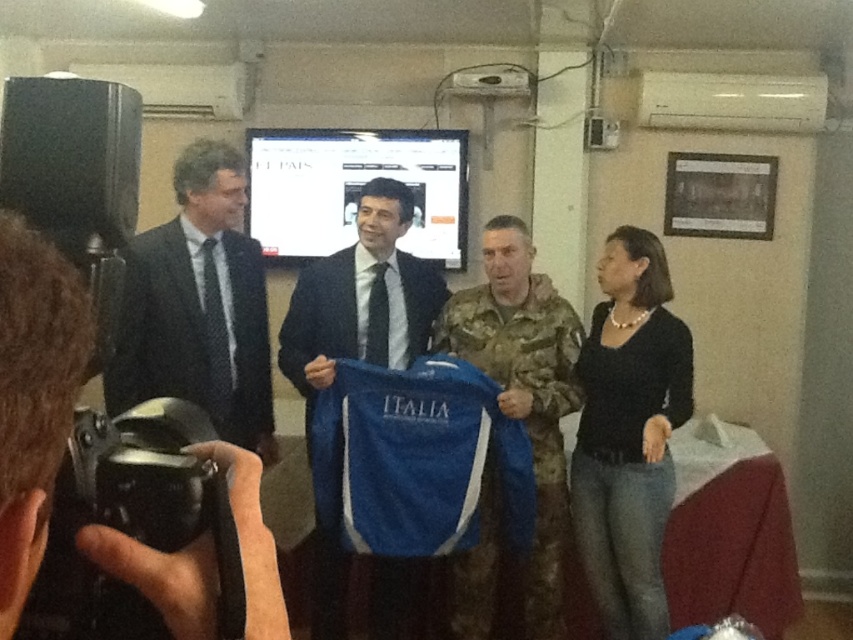
Question: Does blue fabric shirt at center have a larger size compared to matte black suit at center?

Choices:
 (A) yes
 (B) no

Answer: (A)

Question: Which point is farther to the camera?

Choices:
 (A) matte black suit at left
 (B) black plastic video camera at lower left

Answer: (A)

Question: Is black plastic video camera at lower left to the right of camouflagetextured fabric at center from the viewer's perspective?

Choices:
 (A) yes
 (B) no

Answer: (B)

Question: Is matte black suit at left further to camera compared to camouflagetextured fabric at center?

Choices:
 (A) yes
 (B) no

Answer: (B)

Question: Which object is positioned farthest from the camouflagetextured fabric at center?

Choices:
 (A) matte black suit at center
 (B) matte black suit at left

Answer: (A)

Question: Which object is closer to the camera taking this photo?

Choices:
 (A) blue fabric shirt at center
 (B) camouflagetextured fabric at center

Answer: (B)